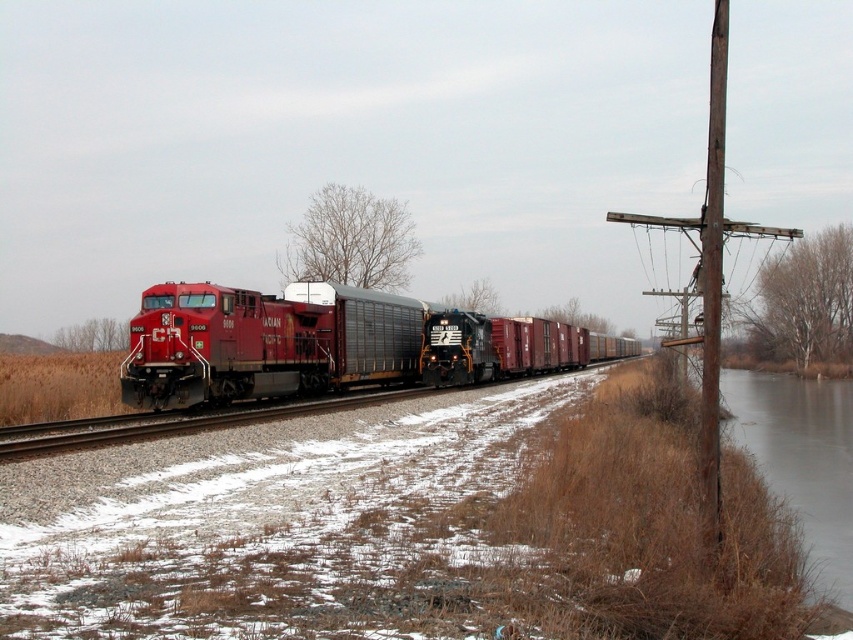
Measure the distance between matte red locomotive at center and camera.

A distance of 75.05 feet exists between matte red locomotive at center and camera.

Who is lower down, matte red locomotive at center or brown wooden pole at right?

matte red locomotive at center is below.

Who is more forward, (207, 348) or (714, 262)?

Point (714, 262)

Locate an element on the screen. matte red locomotive at center is located at coordinates (329, 342).

Is point (703, 268) less distant than point (720, 212)?

No, (703, 268) is behind (720, 212).

Based on the photo, is brown wooden telegraph pole at right to the right of brown wooden pole at right from the viewer's perspective?

No, brown wooden telegraph pole at right is not to the right of brown wooden pole at right.

Which is in front, point (715, 195) or point (718, 538)?

Point (718, 538) is more forward.

The height and width of the screenshot is (640, 853). In order to click on brown wooden telegraph pole at right in this screenshot , I will do `click(711, 273)`.

Based on the photo, is matte red locomotive at center behind brown wooden telegraph pole at right?

Yes, it is.

Is matte red locomotive at center to the right of brown wooden telegraph pole at right from the viewer's perspective?

In fact, matte red locomotive at center is to the left of brown wooden telegraph pole at right.

Which is in front, point (486, 321) or point (724, 3)?

Point (486, 321)

In order to click on matte red locomotive at center in this screenshot , I will do `click(329, 342)`.